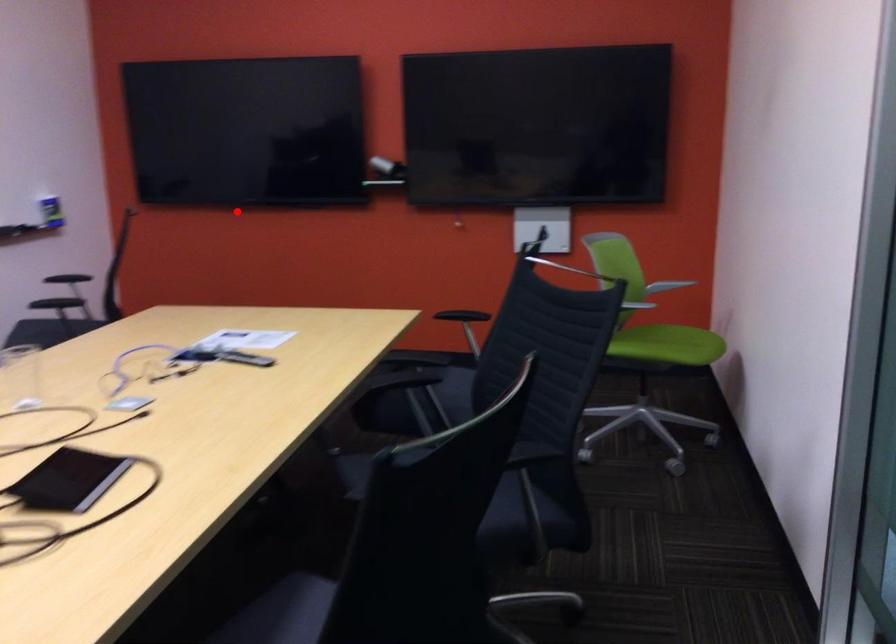
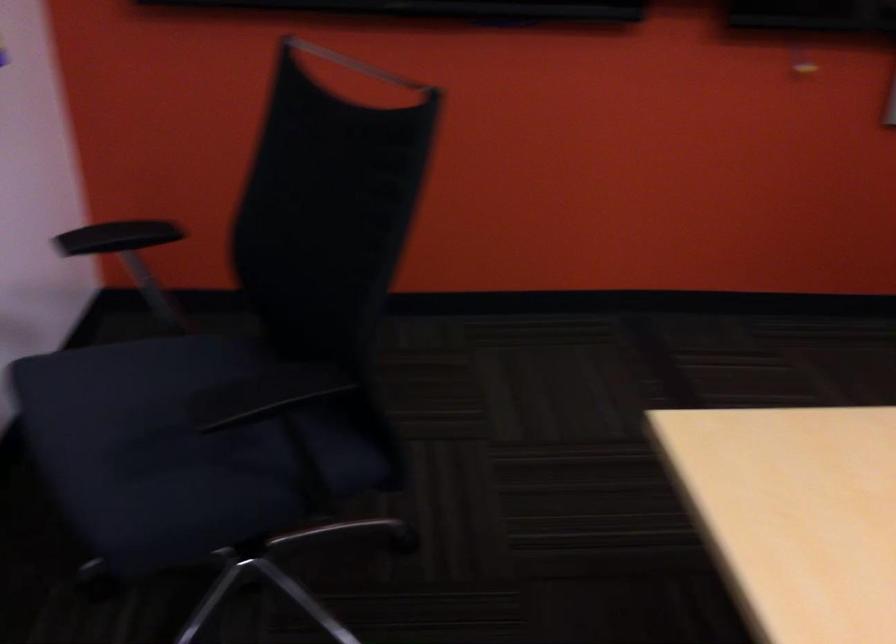
Question: I am providing you with two images of the same scene from different viewpoints. In image1, a red point is highlighted. Considering the same 3D point in image2, which of the following is correct?

Choices:
 (A) It is closer
 (B) It is farther

Answer: (A)